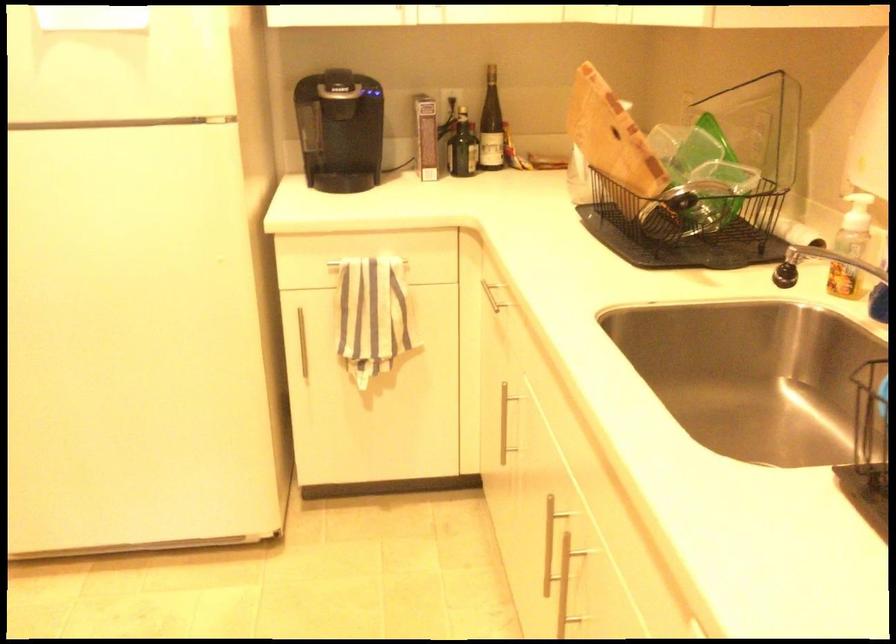
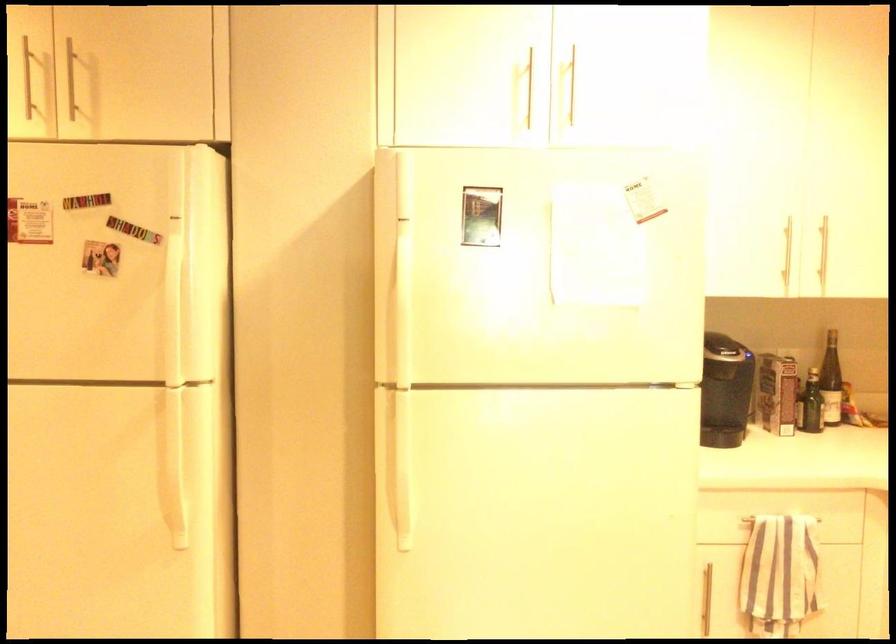
The point at (502, 126) is marked in the first image. Where is the corresponding point in the second image?

(831, 381)